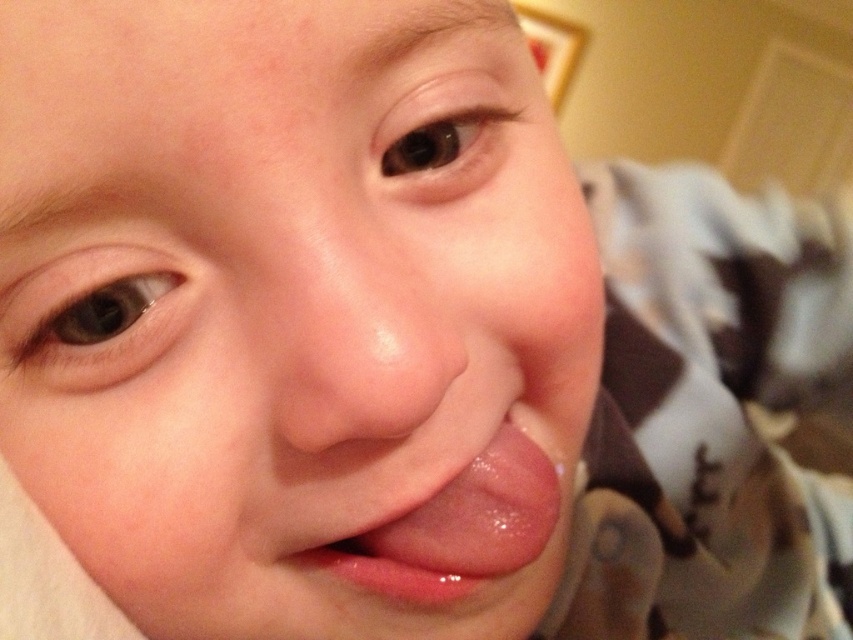
Between smooth flesh nose at center and glossy pink tongue at center, which one is positioned lower?

glossy pink tongue at center is below.

Is smooth flesh nose at center to the right of glossy pink tongue at center from the viewer's perspective?

Incorrect, smooth flesh nose at center is not on the right side of glossy pink tongue at center.

Which is behind, point (311, 246) or point (486, 564)?

The point (486, 564) is behind.

At what (x,y) coordinates should I click in order to perform the action: click on smooth flesh nose at center. Please return your answer as a coordinate pair (x, y). Looking at the image, I should click on (357, 332).

Between smooth skin face at center and glossy pink tongue at center, which one is positioned lower?

glossy pink tongue at center

Is smooth skin face at center taller than glossy pink tongue at center?

Indeed, smooth skin face at center has a greater height compared to glossy pink tongue at center.

Who is more distant from viewer, (345, 80) or (514, 541)?

Positioned behind is point (514, 541).

Find the location of a particular element. smooth skin face at center is located at coordinates (293, 310).

Between smooth skin face at center and smooth flesh nose at center, which one appears on the left side from the viewer's perspective?

Positioned to the left is smooth skin face at center.

Who is shorter, smooth skin face at center or smooth flesh nose at center?

smooth flesh nose at center is shorter.

At what (x,y) coordinates should I click in order to perform the action: click on smooth skin face at center. Please return your answer as a coordinate pair (x, y). The height and width of the screenshot is (640, 853). Looking at the image, I should click on (293, 310).